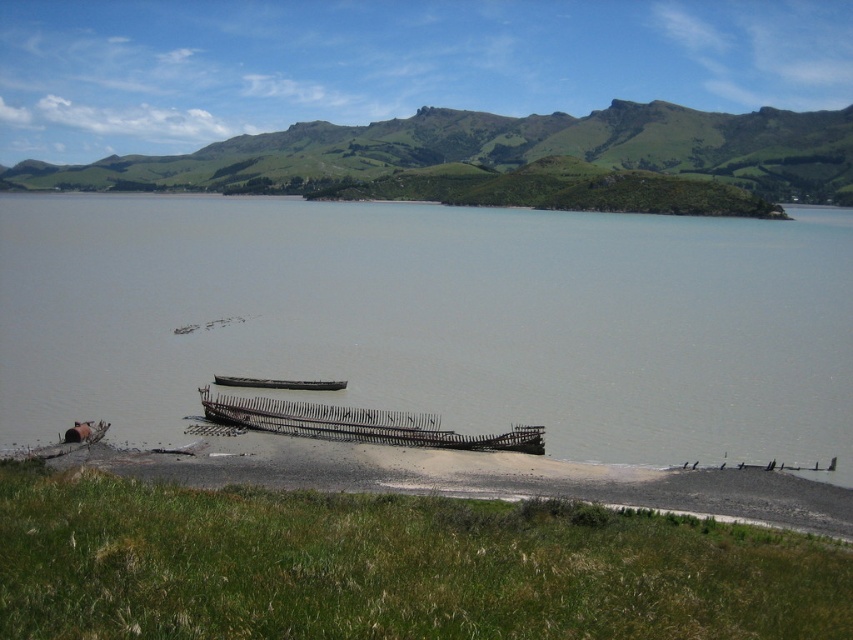
Which is in front, point (425, 212) or point (300, 484)?

Point (300, 484) is in front.

Can you confirm if gray matte water at center is positioned to the left of rusty metal shipwreck at lower left?

Incorrect, gray matte water at center is not on the left side of rusty metal shipwreck at lower left.

Between point (802, 396) and point (238, 435), which one is positioned in front?

Positioned in front is point (238, 435).

Locate an element on the screen. The image size is (853, 640). gray matte water at center is located at coordinates (436, 321).

Does rusty metal shipwreck at lower left appear on the left side of rusty metal boat at center?

No, rusty metal shipwreck at lower left is not to the left of rusty metal boat at center.

Which is in front, point (241, 460) or point (247, 400)?

Point (241, 460) is more forward.

Based on the photo, who is more forward, (480, 467) or (352, 429)?

Point (480, 467) is more forward.

Find the location of a particular element. rusty metal shipwreck at lower left is located at coordinates (471, 477).

Image resolution: width=853 pixels, height=640 pixels. What do you see at coordinates (471, 477) in the screenshot? I see `rusty metal shipwreck at lower left` at bounding box center [471, 477].

Between point (318, 456) and point (276, 387), which one is positioned in front?

Positioned in front is point (318, 456).

Find the location of a particular element. Image resolution: width=853 pixels, height=640 pixels. rusty metal shipwreck at lower left is located at coordinates (471, 477).

The height and width of the screenshot is (640, 853). In order to click on rusty metal shipwreck at lower left in this screenshot , I will do `click(471, 477)`.